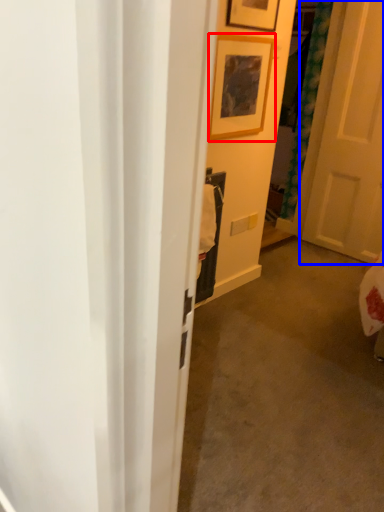
Question: Which of the following is the farthest to the observer, picture frame (highlighted by a red box) or door (highlighted by a blue box)?

Choices:
 (A) picture frame
 (B) door

Answer: (B)